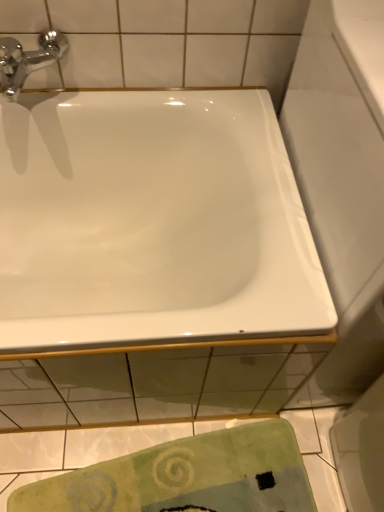
Question: Should I look upward or downward to see green textured towel at lower center?

Choices:
 (A) up
 (B) down

Answer: (B)

Question: From a real-world perspective, is green textured towel at lower center on chrome/metallic faucet at upper left?

Choices:
 (A) no
 (B) yes

Answer: (A)

Question: Could you tell me if green textured towel at lower center is turned towards chrome/metallic faucet at upper left?

Choices:
 (A) no
 (B) yes

Answer: (A)

Question: Is the depth of green textured towel at lower center greater than that of chrome/metallic faucet at upper left?

Choices:
 (A) no
 (B) yes

Answer: (B)

Question: Is green textured towel at lower center shorter than chrome/metallic faucet at upper left?

Choices:
 (A) no
 (B) yes

Answer: (B)

Question: Would you say green textured towel at lower center is a long distance from chrome/metallic faucet at upper left?

Choices:
 (A) no
 (B) yes

Answer: (B)

Question: Can you confirm if green textured towel at lower center is smaller than chrome/metallic faucet at upper left?

Choices:
 (A) yes
 (B) no

Answer: (B)

Question: From a real-world perspective, is white glossy bathtub at upper center on top of chrome/metallic faucet at upper left?

Choices:
 (A) yes
 (B) no

Answer: (B)

Question: Can you confirm if white glossy bathtub at upper center is wider than chrome/metallic faucet at upper left?

Choices:
 (A) no
 (B) yes

Answer: (B)

Question: Considering the relative positions of white glossy bathtub at upper center and chrome/metallic faucet at upper left in the image provided, is white glossy bathtub at upper center in front of chrome/metallic faucet at upper left?

Choices:
 (A) no
 (B) yes

Answer: (B)

Question: Is white glossy bathtub at upper center directly adjacent to chrome/metallic faucet at upper left?

Choices:
 (A) no
 (B) yes

Answer: (A)

Question: Does white glossy bathtub at upper center have a lesser height compared to chrome/metallic faucet at upper left?

Choices:
 (A) no
 (B) yes

Answer: (A)

Question: Does white glossy bathtub at upper center turn towards chrome/metallic faucet at upper left?

Choices:
 (A) yes
 (B) no

Answer: (B)

Question: Can you confirm if white glossy bathtub at upper center is shorter than green textured towel at lower center?

Choices:
 (A) no
 (B) yes

Answer: (A)